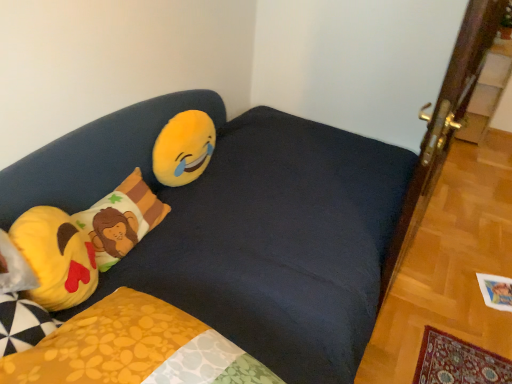
You are a GUI agent. You are given a task and a screenshot of the screen. Output one action in this format:
    pyautogui.click(x=<x>, y=<y>)
    Task: Click on the vacant point above fluffy cotton pillow with lion design at left, acting as the 2th pillow starting from the front (from a real-world perspective)
    The image size is (512, 384).
    Given the screenshot: What is the action you would take?
    pyautogui.click(x=109, y=203)